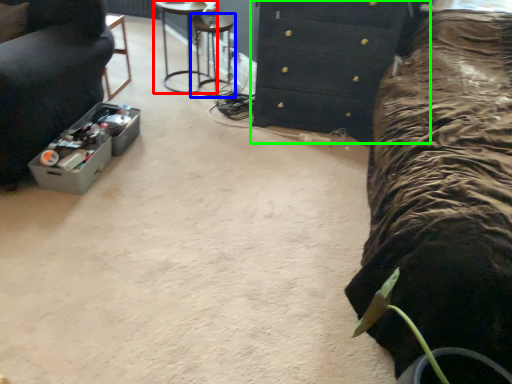
Question: Which object is the farthest from furniture (highlighted by a red box)? Choose among these: bar stool (highlighted by a blue box) or chest of drawers (highlighted by a green box).

Choices:
 (A) bar stool
 (B) chest of drawers

Answer: (B)